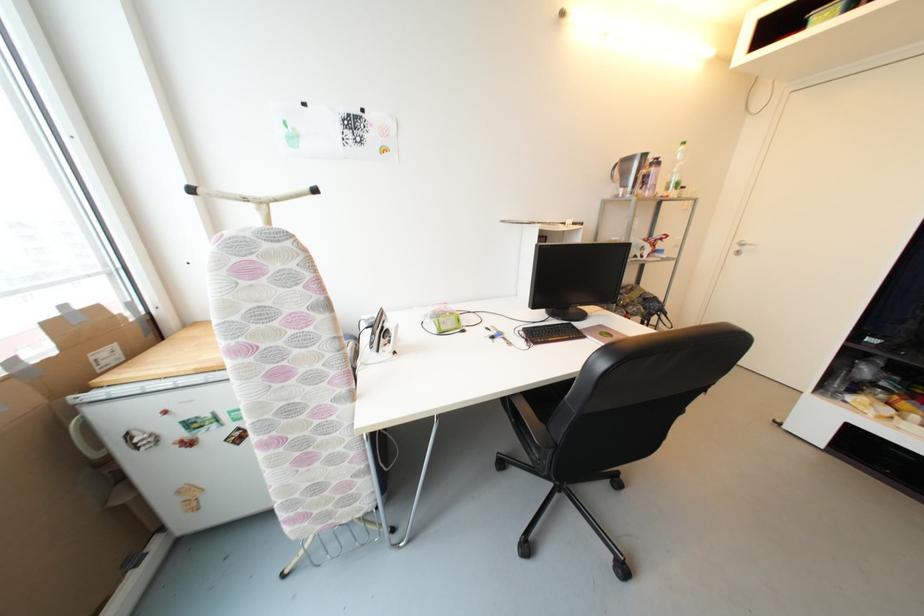
At what (x,y) coordinates should I click in order to perform the action: click on silver door handle. Please return your answer as a coordinate pair (x, y). The width and height of the screenshot is (924, 616). Looking at the image, I should click on (743, 246).